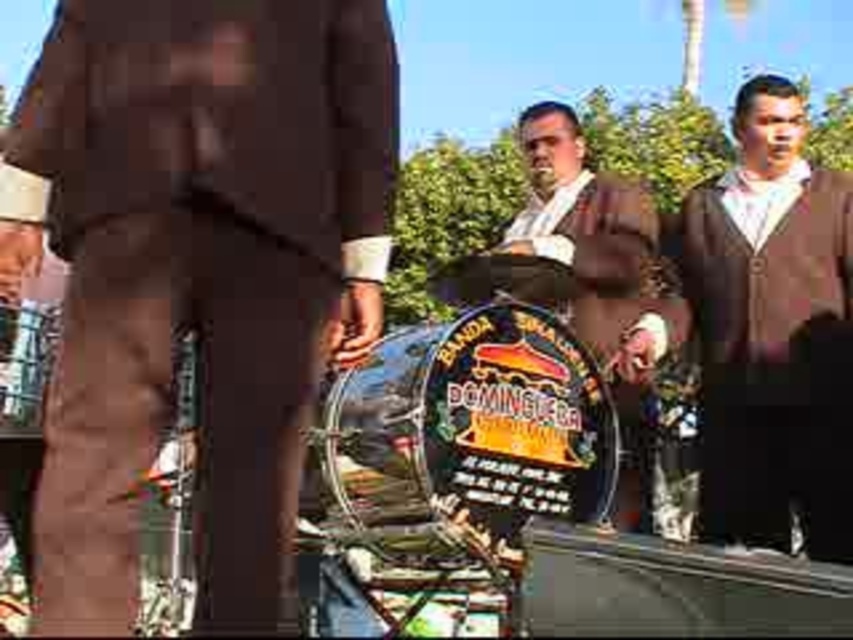
Question: Is brown wool sweater at right in front of shiny brown leather jacket at center?

Choices:
 (A) no
 (B) yes

Answer: (B)

Question: Among these objects, which one is nearest to the camera?

Choices:
 (A) shiny brown leather jacket at center
 (B) brown wool sweater at right
 (C) brown fabric pants at center

Answer: (C)

Question: Does brown fabric pants at center have a larger size compared to shiny brown leather jacket at center?

Choices:
 (A) no
 (B) yes

Answer: (A)

Question: Among these objects, which one is farthest from the camera?

Choices:
 (A) brown fabric pants at center
 (B) shiny brown leather jacket at center
 (C) brown wool sweater at right

Answer: (B)

Question: Among these points, which one is farthest from the camera?

Choices:
 (A) (814, 413)
 (B) (76, 392)
 (C) (605, 212)

Answer: (C)

Question: Can you confirm if brown fabric pants at center is positioned above brown wool sweater at right?

Choices:
 (A) yes
 (B) no

Answer: (A)